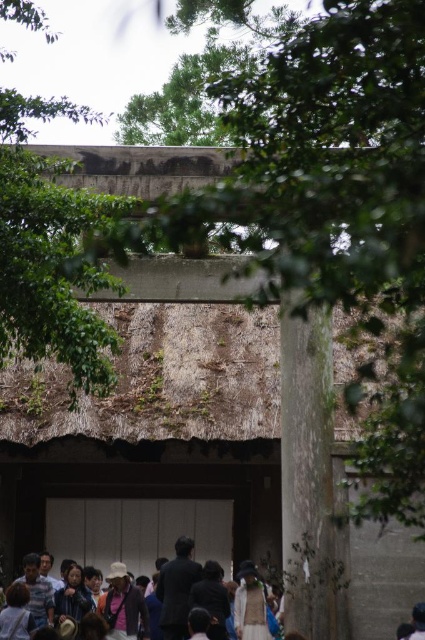
You are standing in front of the torii gate and notice the smooth gray stone pillar at right and the light brown fabric jacket at lower center. Which object is positioned higher in the image?

The smooth gray stone pillar at right is above the light brown fabric jacket at lower center, so it is positioned higher in the image.

You are standing in front of the torii gate and want to take a photo of the light brown fabric jacket at lower center without the green leafy tree at upper center blocking the view. Is the tree closer to you than the jacket?

Yes, the green leafy tree at upper center is closer to the viewer than the light brown fabric jacket at lower center, so it will block the view of the jacket.